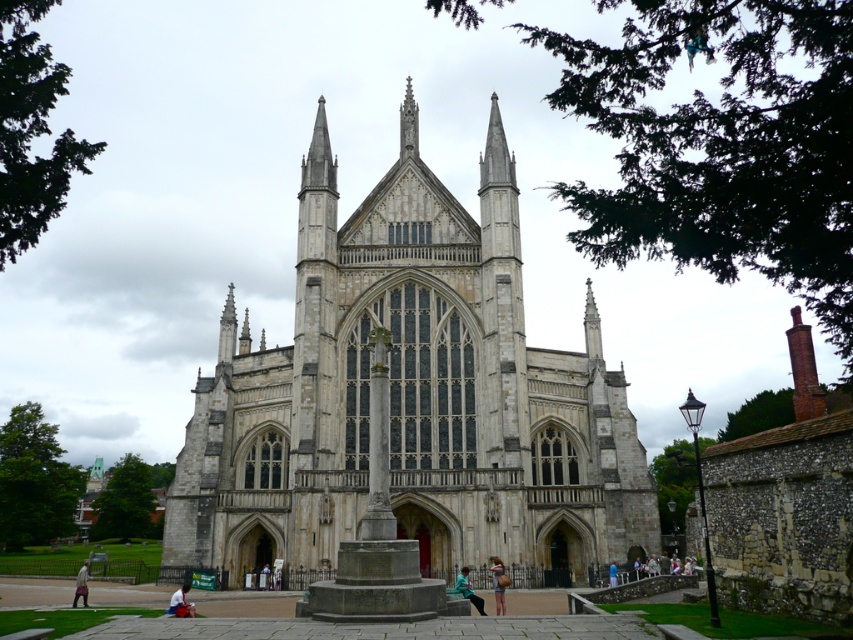
Looking at this image, which of these two, stone church at center or smooth stone spire at upper center, stands shorter?

Standing shorter between the two is smooth stone spire at upper center.

Who is more distant from viewer, (538, 365) or (247, 342)?

Point (247, 342)

The width and height of the screenshot is (853, 640). In order to click on stone church at center in this screenshot , I will do `click(410, 397)`.

Is light blue denim jeans at lower center above light blue jeans at center?

Yes.

Image resolution: width=853 pixels, height=640 pixels. I want to click on light blue denim jeans at lower center, so click(497, 584).

You are a GUI agent. You are given a task and a screenshot of the screen. Output one action in this format:
    pyautogui.click(x=<x>, y=<y>)
    Task: Click on the light blue denim jeans at lower center
    The width and height of the screenshot is (853, 640).
    Given the screenshot: What is the action you would take?
    pyautogui.click(x=497, y=584)

Between green leafy tree at left and green fabric jacket at lower center, which one is positioned lower?

green fabric jacket at lower center is below.

Is green leafy tree at left behind green fabric jacket at lower center?

Yes, green leafy tree at left is behind green fabric jacket at lower center.

The width and height of the screenshot is (853, 640). Identify the location of green leafy tree at left. (33, 481).